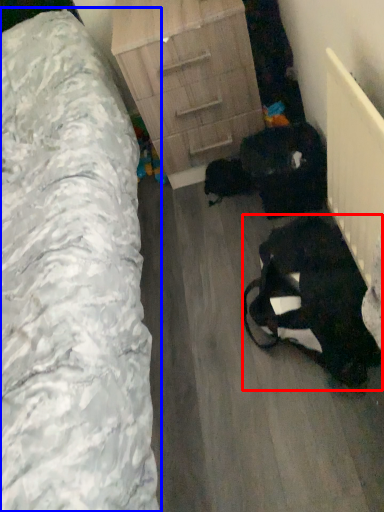
Question: Which object is closer to the camera taking this photo, animal (highlighted by a red box) or furniture (highlighted by a blue box)?

Choices:
 (A) animal
 (B) furniture

Answer: (B)